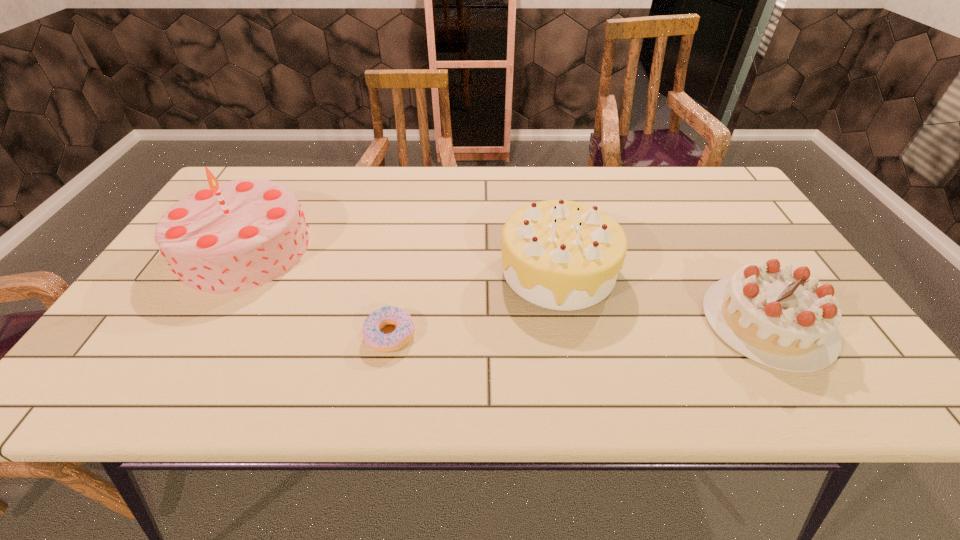
Identify the location of free spot between the rightmost birthday cake and the leftmost object. The image size is (960, 540). (506, 285).

This screenshot has width=960, height=540. In order to click on object that is the second nearest to the doughnut in this screenshot , I will do `click(229, 237)`.

Locate an element on the screen. This screenshot has width=960, height=540. the closest object to the second object from right to left is located at coordinates (778, 316).

You are a GUI agent. You are given a task and a screenshot of the screen. Output one action in this format:
    pyautogui.click(x=<x>, y=<y>)
    Task: Click on the birthday cake that stands as the third closest to the second object from left to right
    The image size is (960, 540).
    Given the screenshot: What is the action you would take?
    pyautogui.click(x=778, y=316)

Where is `birthday cake that is the nearest to the leftmost birthday cake`? This screenshot has width=960, height=540. birthday cake that is the nearest to the leftmost birthday cake is located at coordinates (564, 255).

The height and width of the screenshot is (540, 960). I want to click on vacant region that satisfies the following two spatial constraints: 1. on the back side of the shortest birthday cake; 2. on the left side of the third object from right to left, so click(393, 322).

Locate an element on the screen. Image resolution: width=960 pixels, height=540 pixels. vacant point that satisfies the following two spatial constraints: 1. on the back side of the doughnut; 2. on the left side of the shortest birthday cake is located at coordinates pos(393,322).

Where is `vacant space that satisfies the following two spatial constraints: 1. on the back side of the second tallest object; 2. on the left side of the third object from right to left`? The height and width of the screenshot is (540, 960). vacant space that satisfies the following two spatial constraints: 1. on the back side of the second tallest object; 2. on the left side of the third object from right to left is located at coordinates (402, 270).

Locate an element on the screen. This screenshot has height=540, width=960. vacant space that satisfies the following two spatial constraints: 1. on the back side of the second birthday cake from left to right; 2. on the left side of the shortest object is located at coordinates (x=402, y=270).